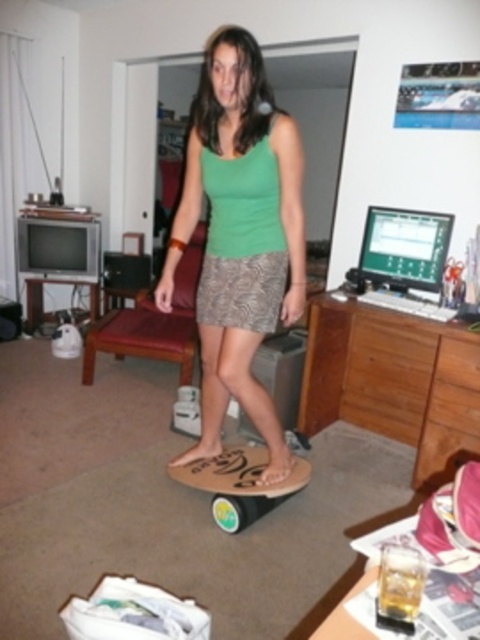
Based on the photo, can you confirm if green fabric tank top at center is shorter than wooden skateboard at center?

Incorrect, green fabric tank top at center's height does not fall short of wooden skateboard at center's.

Between point (210, 308) and point (297, 477), which one is positioned behind?

Point (297, 477)

The width and height of the screenshot is (480, 640). I want to click on green fabric tank top at center, so click(240, 236).

Is wooden dresser at center-right bigger than wooden skateboard at center?

Yes, wooden dresser at center-right is bigger than wooden skateboard at center.

Does wooden dresser at center-right appear on the right side of wooden skateboard at center?

Yes, wooden dresser at center-right is to the right of wooden skateboard at center.

The width and height of the screenshot is (480, 640). What are the coordinates of `wooden dresser at center-right` in the screenshot? It's located at (394, 381).

Does point (231, 232) lie in front of point (381, 326)?

Yes, it is in front of point (381, 326).

Who is shorter, green fabric tank top at center or wooden dresser at center-right?

Standing shorter between the two is wooden dresser at center-right.

Is point (252, 45) farther from viewer compared to point (424, 369)?

No, (252, 45) is closer to viewer.

Image resolution: width=480 pixels, height=640 pixels. Identify the location of green fabric tank top at center. (240, 236).